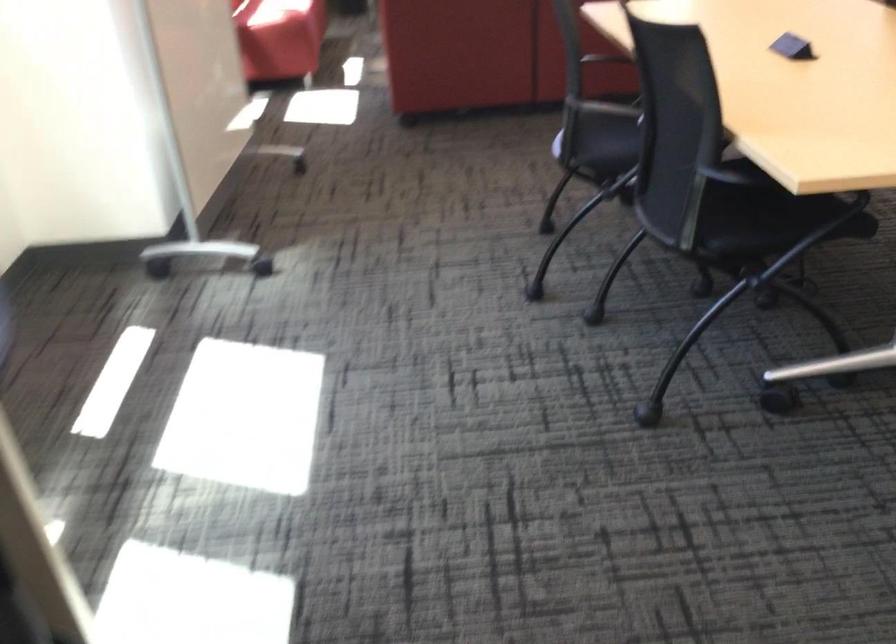
The image size is (896, 644). What do you see at coordinates (604, 59) in the screenshot? I see `the black chair armrest` at bounding box center [604, 59].